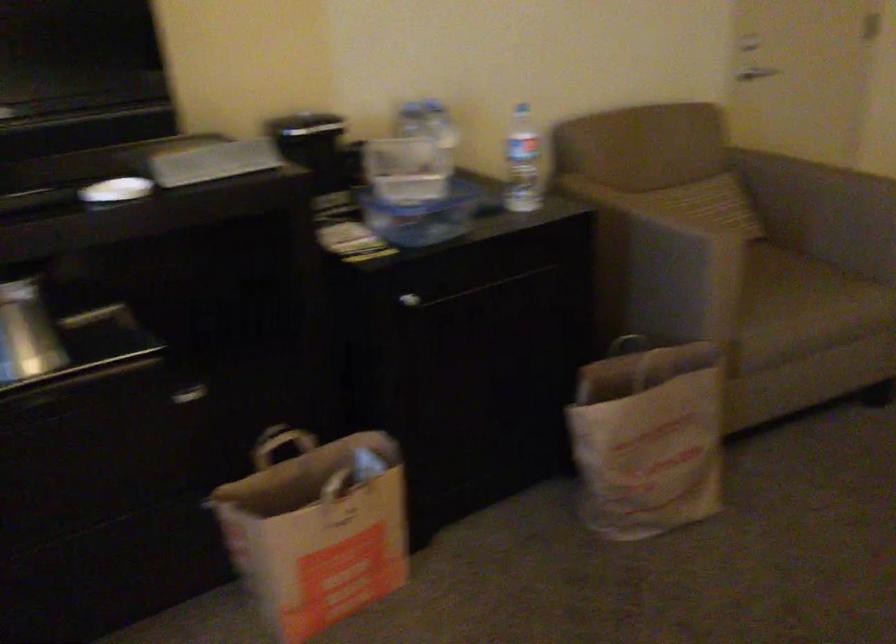
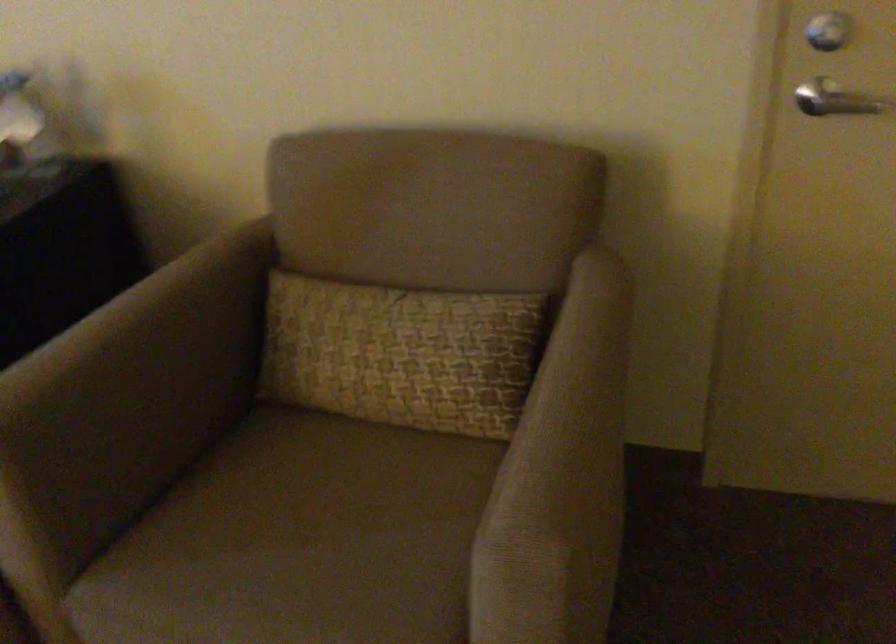
Find the pixel in the second image that matches point (746, 272) in the first image.

(314, 500)